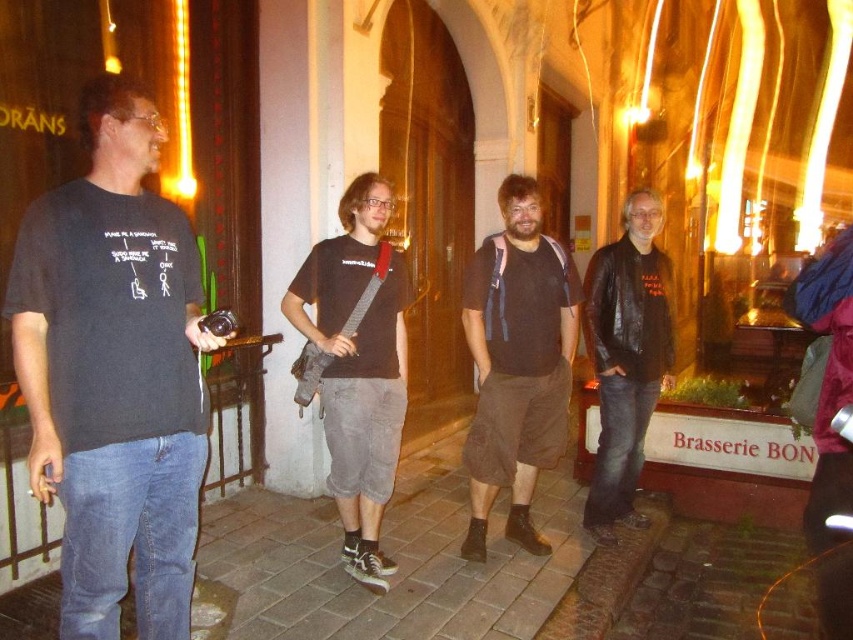
Question: Which object appears closest to the camera in this image?

Choices:
 (A) dark gray t-shirt at left
 (B) black cotton t-shirt at center
 (C) brown cotton shorts at center
 (D) brown brick pavement at lower center

Answer: (A)

Question: From the image, what is the correct spatial relationship of brown cotton shorts at center in relation to black cotton t-shirt at center?

Choices:
 (A) above
 (B) below

Answer: (A)

Question: From the image, what is the correct spatial relationship of dark gray t-shirt at left in relation to black cotton t-shirt at center?

Choices:
 (A) left
 (B) right

Answer: (A)

Question: Which is farther from the brown brick pavement at lower center?

Choices:
 (A) dark gray t-shirt at left
 (B) leather jacket at center

Answer: (A)

Question: Can you confirm if dark gray t-shirt at left is smaller than brown cotton shorts at center?

Choices:
 (A) no
 (B) yes

Answer: (B)

Question: Which object is positioned farthest from the leather jacket at center?

Choices:
 (A) brown brick pavement at lower center
 (B) dark gray t-shirt at left
 (C) black cotton t-shirt at center

Answer: (B)